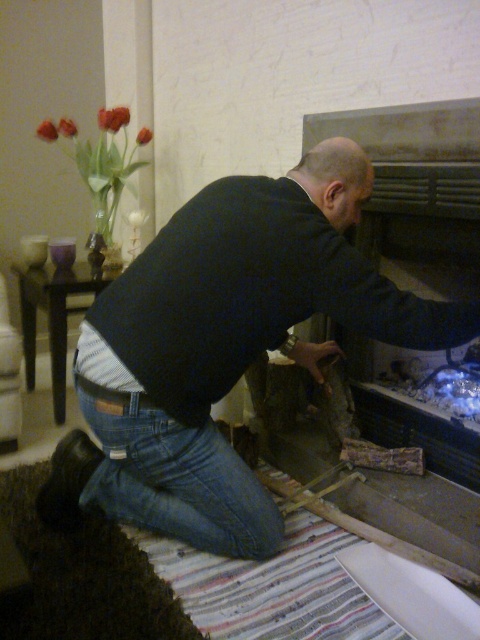
Question: Does dark blue sweater at center appear on the left side of denim at lower left?

Choices:
 (A) yes
 (B) no

Answer: (B)

Question: Does dark blue sweater at center have a larger size compared to denim at lower left?

Choices:
 (A) no
 (B) yes

Answer: (B)

Question: Does dark blue sweater at center come behind denim at lower left?

Choices:
 (A) no
 (B) yes

Answer: (A)

Question: Which object appears farthest from the camera in this image?

Choices:
 (A) denim at lower left
 (B) dark blue sweater at center

Answer: (A)